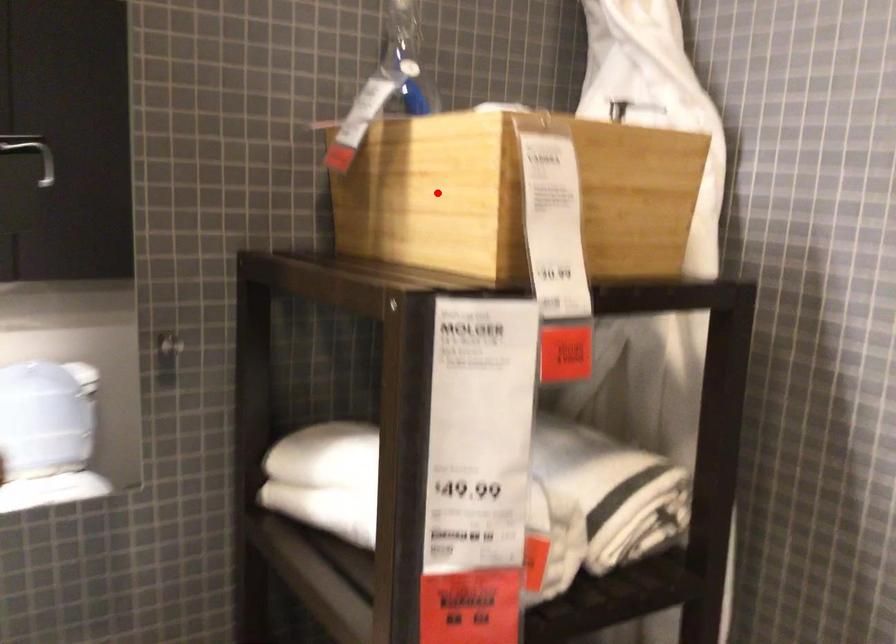
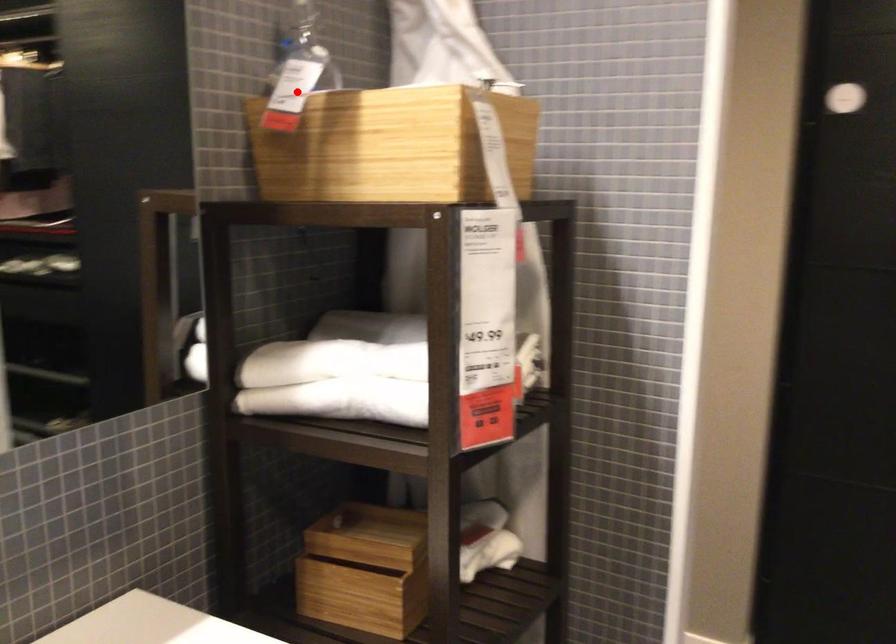
Looking at this image, I am providing you with two images of the same scene from different viewpoints. A red point is marked on the first image and another point is marked on the second image. Is the marked point in image1 the same physical position as the marked point in image2?

No